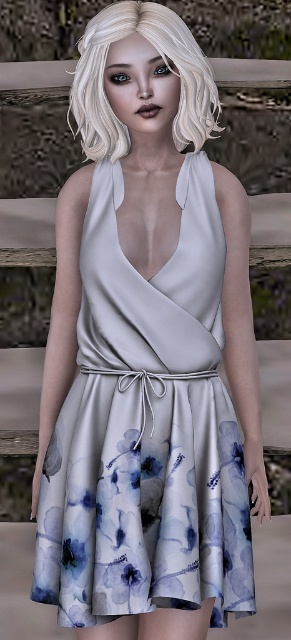
Is satin floral dress at center below blonde silky hair at upper center?

Yes.

Does satin floral dress at center appear on the right side of blonde silky hair at upper center?

Correct, you'll find satin floral dress at center to the right of blonde silky hair at upper center.

Based on the photo, who is more forward, [203,372] or [181,49]?

Point [181,49] is in front.

You are a GUI agent. You are given a task and a screenshot of the screen. Output one action in this format:
    pyautogui.click(x=<x>, y=<y>)
    Task: Click on the satin floral dress at center
    The height and width of the screenshot is (640, 291).
    Given the screenshot: What is the action you would take?
    pyautogui.click(x=146, y=429)